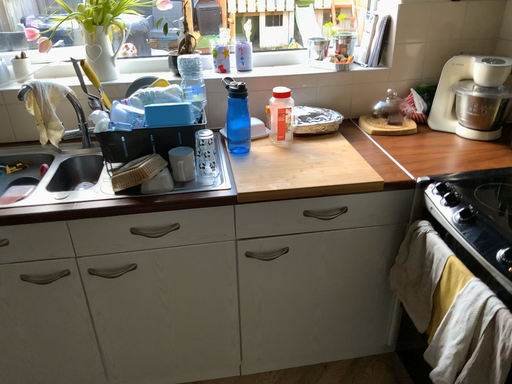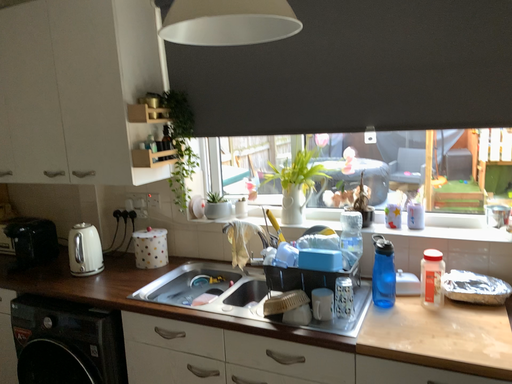
Question: Which way did the camera rotate in the video?

Choices:
 (A) rotated downward
 (B) rotated upward

Answer: (B)